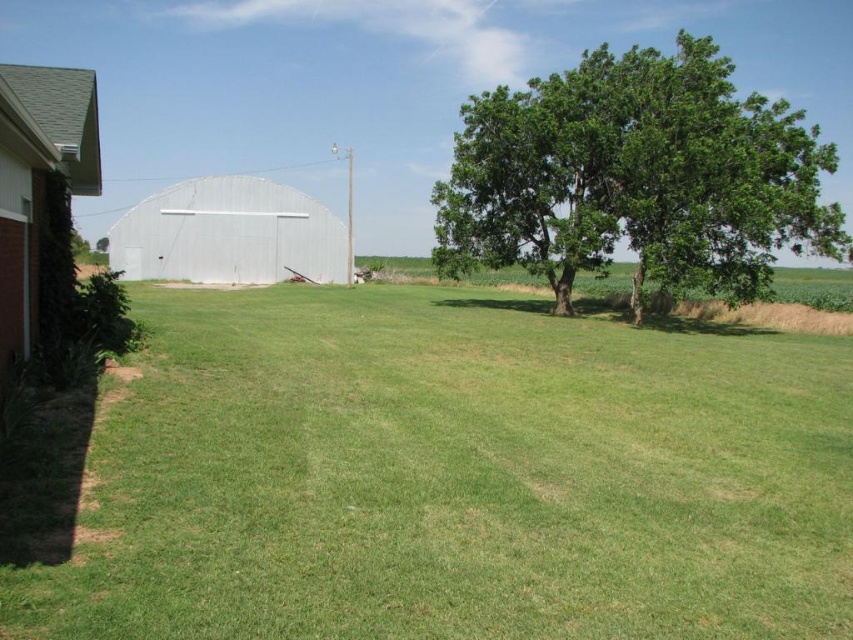
Who is higher up, green leafy tree at upper right or white metallic barn at center?

green leafy tree at upper right

Does green leafy tree at upper right have a lesser width compared to white metallic barn at center?

No, green leafy tree at upper right is not thinner than white metallic barn at center.

What are the coordinates of `green leafy tree at upper right` in the screenshot? It's located at (636, 177).

Can you confirm if white metallic barn at center is positioned to the right of brick/red brick barn at left?

No, white metallic barn at center is not to the right of brick/red brick barn at left.

This screenshot has height=640, width=853. What do you see at coordinates (229, 234) in the screenshot?
I see `white metallic barn at center` at bounding box center [229, 234].

Find the location of `white metallic barn at center`. white metallic barn at center is located at coordinates (229, 234).

Can you confirm if green leafy tree at upper right is positioned above brick/red brick barn at left?

Indeed, green leafy tree at upper right is positioned over brick/red brick barn at left.

Who is positioned more to the left, green leafy tree at upper right or brick/red brick barn at left?

brick/red brick barn at left

Between point (556, 152) and point (4, 353), which one is positioned behind?

The point (556, 152) is behind.

Find the location of `green leafy tree at upper right`. green leafy tree at upper right is located at coordinates pos(636,177).